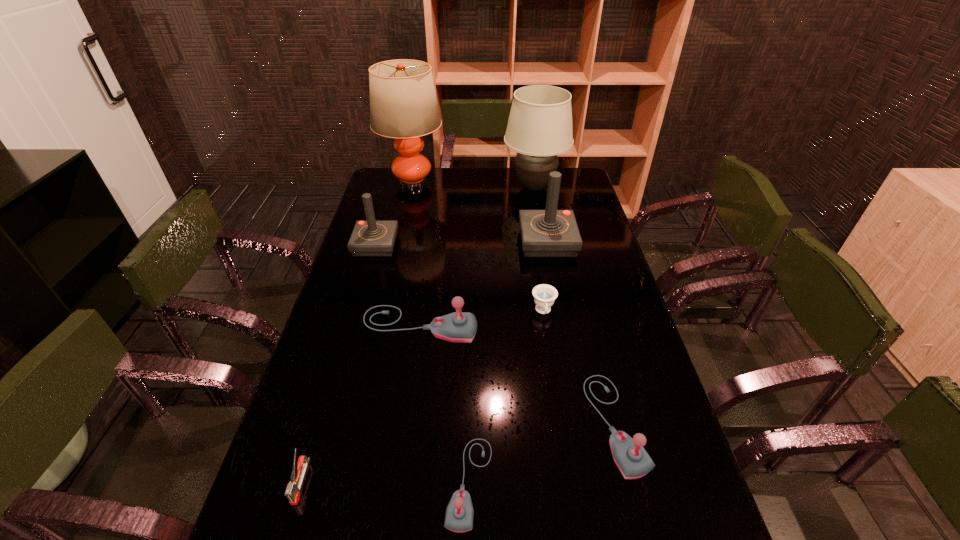
Find the location of a particular element. free space located on the rectangular base of the sixth shortest object is located at coordinates (348, 341).

The height and width of the screenshot is (540, 960). I want to click on free space located on the front of the fifth shortest object, so click(x=399, y=469).

Find the location of a particular element. blank area located 0.300m on the back of the fourth tallest joystick is located at coordinates (583, 298).

At what (x,y) coordinates should I click in order to perform the action: click on free space located 0.050m on the handle side of the stapler. Please return your answer as a coordinate pair (x, y). The height and width of the screenshot is (540, 960). Looking at the image, I should click on (286, 531).

Identify the location of vacant area located 0.170m on the right of the shortest joystick. (570, 483).

At what (x,y) coordinates should I click in order to perform the action: click on free space located on the side of the shortest object with the handle. Please return your answer as a coordinate pair (x, y). Looking at the image, I should click on (553, 376).

Identify the location of lamp positioned at the far edge. This screenshot has width=960, height=540. (403, 104).

What are the coordinates of `lampshade at the far edge` in the screenshot? It's located at (539, 128).

You are a GUI agent. You are given a task and a screenshot of the screen. Output one action in this format:
    pyautogui.click(x=<x>, y=<y>)
    Task: Click on the lamp that is at the left edge
    This screenshot has height=540, width=960.
    Given the screenshot: What is the action you would take?
    pyautogui.click(x=403, y=104)

Locate an element on the screen. stapler situated at the left edge is located at coordinates 299,468.